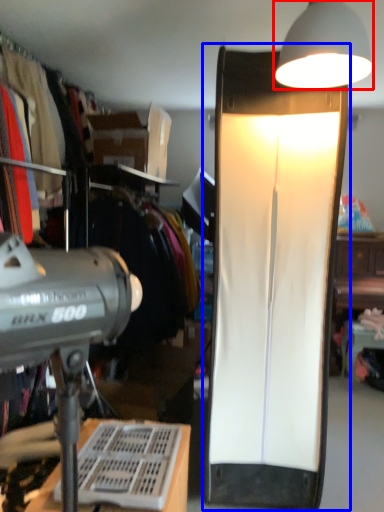
Question: Which object appears farthest to the camera in this image, lamp (highlighted by a red box) or lamp (highlighted by a blue box)?

Choices:
 (A) lamp
 (B) lamp

Answer: (B)